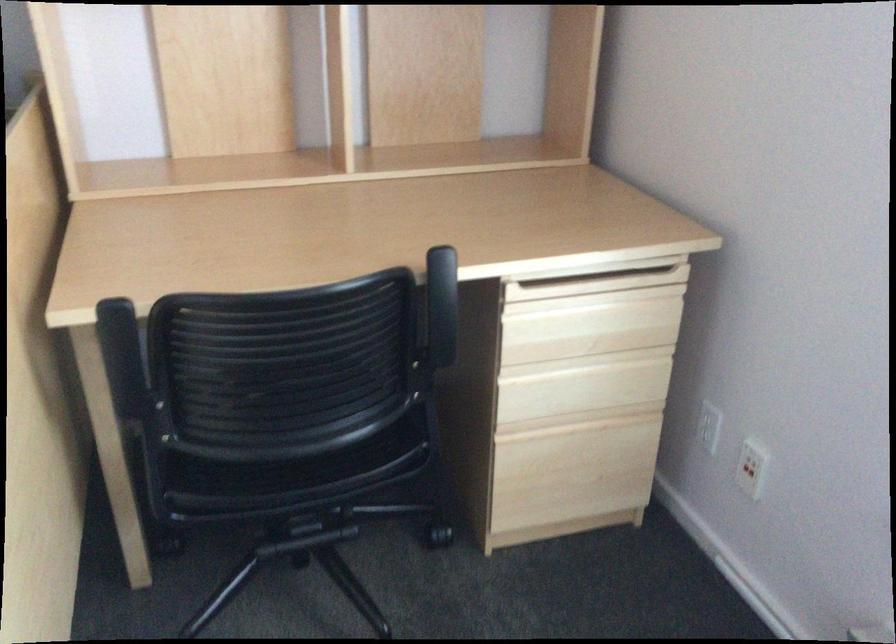
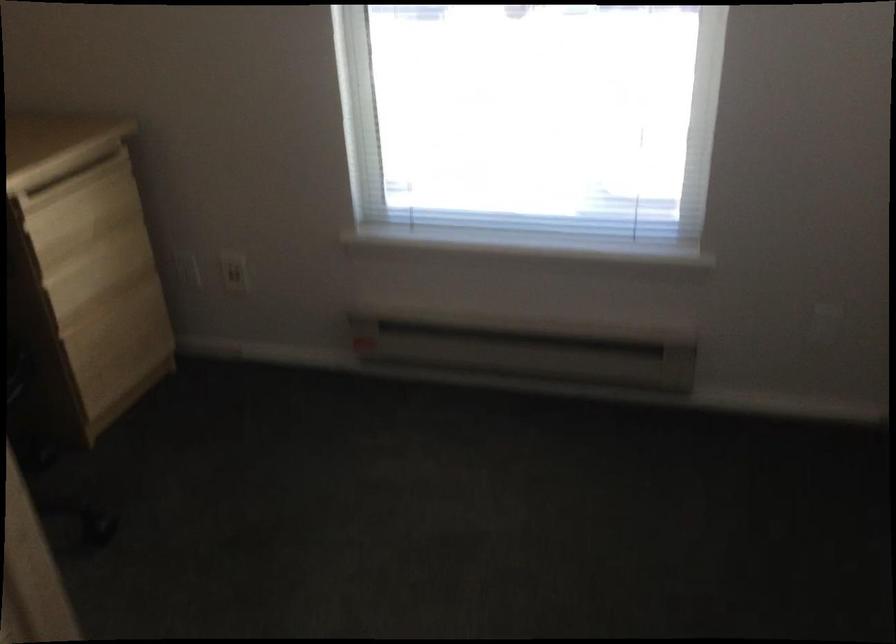
Question: The camera is either moving clockwise (left) or counter-clockwise (right) around the object. The first image is from the beginning of the video and the second image is from the end. Is the camera moving left or right when shooting the video?

Choices:
 (A) Left
 (B) Right

Answer: (A)